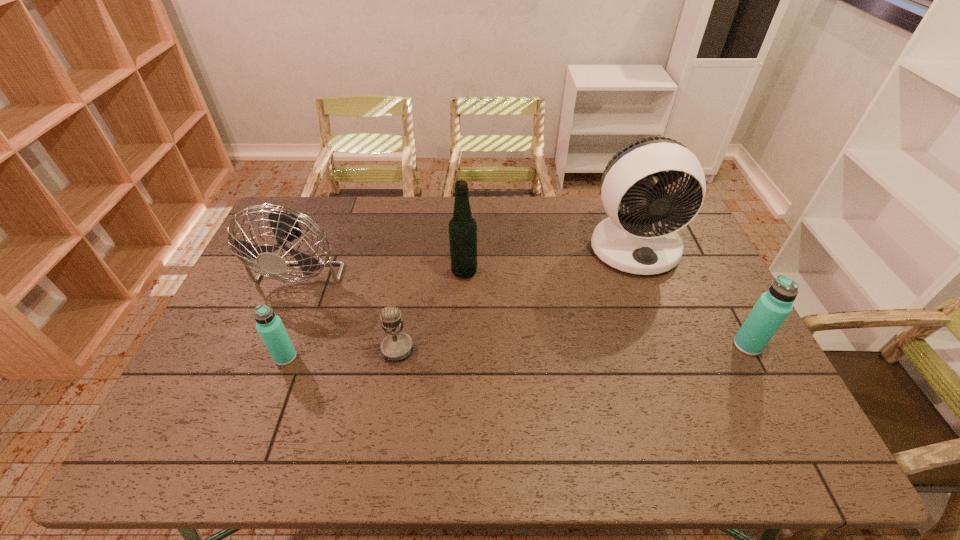
The height and width of the screenshot is (540, 960). I want to click on free space that satisfies the following two spatial constraints: 1. on the grille of the taller thermos bottle; 2. on the left side of the right fan, so (670, 345).

Find the location of `blank space that satisfies the following two spatial constraints: 1. on the front-facing side of the left fan; 2. on the right side of the third object from right to left`. blank space that satisfies the following two spatial constraints: 1. on the front-facing side of the left fan; 2. on the right side of the third object from right to left is located at coordinates (301, 272).